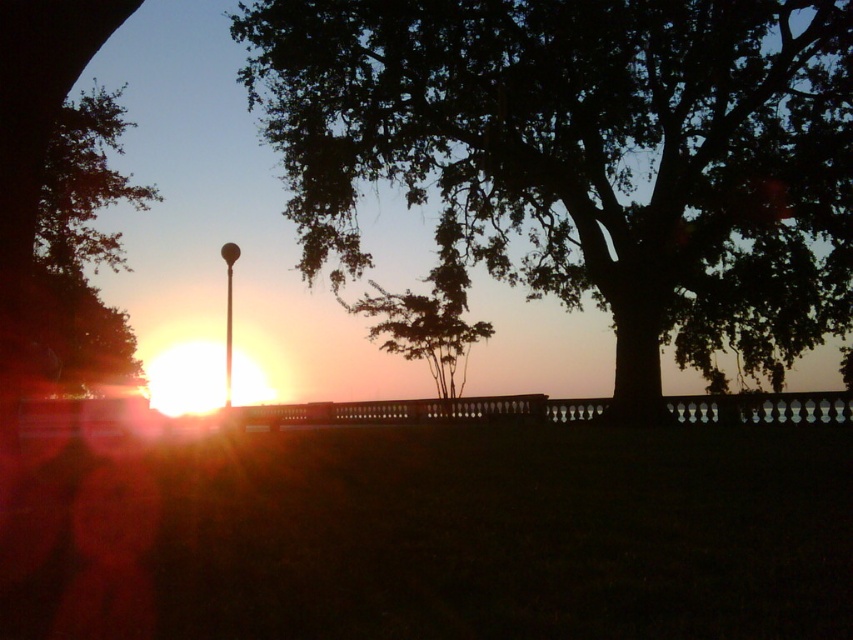
Can you confirm if green leafy tree at left is positioned above green leafy tree at center?

Yes, green leafy tree at left is above green leafy tree at center.

Between point (83, 292) and point (381, 312), which one is positioned behind?

The point (381, 312) is behind.

At what (x,y) coordinates should I click in order to perform the action: click on green leafy tree at left. Please return your answer as a coordinate pair (x, y). The height and width of the screenshot is (640, 853). Looking at the image, I should click on (82, 248).

Can you confirm if dark green leafy tree at center is smaller than green leafy tree at center?

Incorrect, dark green leafy tree at center is not smaller in size than green leafy tree at center.

How far apart are dark green leafy tree at center and green leafy tree at center?

10.11 meters

In order to click on dark green leafy tree at center in this screenshot , I will do `click(584, 154)`.

Which is in front, point (415, 330) or point (234, 260)?

Point (234, 260) is in front.

How distant is green leafy tree at center from metallic pole at center?

green leafy tree at center is 8.45 meters from metallic pole at center.

Find the location of `green leafy tree at center`. green leafy tree at center is located at coordinates coord(428,317).

This screenshot has width=853, height=640. I want to click on green leafy tree at center, so click(x=428, y=317).